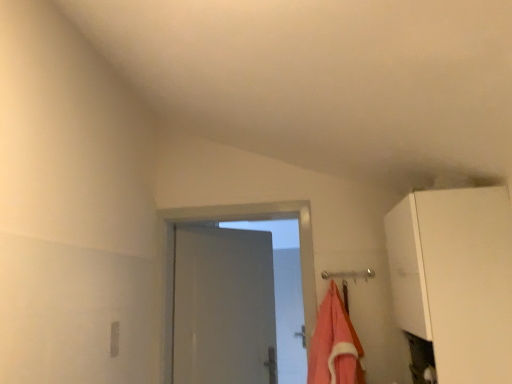
Describe the element at coordinates (334, 345) in the screenshot. I see `orange cotton towel at center` at that location.

Image resolution: width=512 pixels, height=384 pixels. Find the location of `orange cotton towel at center`. orange cotton towel at center is located at coordinates (334, 345).

Where is `white matte cabinet at upper right`? The width and height of the screenshot is (512, 384). white matte cabinet at upper right is located at coordinates (455, 279).

Image resolution: width=512 pixels, height=384 pixels. What do you see at coordinates (455, 279) in the screenshot?
I see `white matte cabinet at upper right` at bounding box center [455, 279].

In order to click on orange cotton towel at center in this screenshot , I will do `click(334, 345)`.

Is white matte cabinet at upper right at the left side of orange cotton towel at center?

No, white matte cabinet at upper right is not to the left of orange cotton towel at center.

Does white matte cabinet at upper right lie behind orange cotton towel at center?

That is False.

Which point is more forward, [417,333] or [324,303]?

The point [417,333] is closer.

From the image's perspective, is white matte cabinet at upper right below orange cotton towel at center?

No.

From a real-world perspective, is white matte cabinet at upper right physically above orange cotton towel at center?

Indeed, from a real-world perspective, white matte cabinet at upper right stands above orange cotton towel at center.

Is white matte cabinet at upper right wider or thinner than orange cotton towel at center?

Clearly, white matte cabinet at upper right has more width compared to orange cotton towel at center.

From their relative heights in the image, would you say white matte cabinet at upper right is taller or shorter than orange cotton towel at center?

white matte cabinet at upper right is taller than orange cotton towel at center.

Considering the sizes of white matte cabinet at upper right and orange cotton towel at center in the image, is white matte cabinet at upper right bigger or smaller than orange cotton towel at center?

Considering their sizes, white matte cabinet at upper right takes up more space than orange cotton towel at center.

Is white matte cabinet at upper right inside or outside of orange cotton towel at center?

white matte cabinet at upper right is not inside orange cotton towel at center, it's outside.

Are white matte cabinet at upper right and orange cotton towel at center far apart?

No, white matte cabinet at upper right is in close proximity to orange cotton towel at center.

Is white matte cabinet at upper right oriented away from orange cotton towel at center?

No.

Can you tell me how much white matte cabinet at upper right and orange cotton towel at center differ in facing direction?

87.1 degrees.

In order to click on cabinetry on the right of orange cotton towel at center in this screenshot , I will do `click(455, 279)`.

Can you confirm if orange cotton towel at center is positioned to the right of white matte cabinet at upper right?

Incorrect, orange cotton towel at center is not on the right side of white matte cabinet at upper right.

Considering their positions, is orange cotton towel at center located in front of or behind white matte cabinet at upper right?

Visually, orange cotton towel at center is located behind white matte cabinet at upper right.

Is point (339, 380) more distant than point (492, 292)?

Yes, it is behind point (492, 292).

From the image's perspective, is orange cotton towel at center positioned above or below white matte cabinet at upper right?

Based on their image positions, orange cotton towel at center is located beneath white matte cabinet at upper right.

From a real-world perspective, is orange cotton towel at center below white matte cabinet at upper right?

Correct, in the physical world, orange cotton towel at center is lower than white matte cabinet at upper right.

Which object is wider, orange cotton towel at center or white matte cabinet at upper right?

white matte cabinet at upper right.

Can you confirm if orange cotton towel at center is shorter than white matte cabinet at upper right?

Correct, orange cotton towel at center is not as tall as white matte cabinet at upper right.

From the picture: Who is smaller, orange cotton towel at center or white matte cabinet at upper right?

orange cotton towel at center is smaller.

Is orange cotton towel at center positioned beyond the bounds of white matte cabinet at upper right?

Yes, orange cotton towel at center is not within white matte cabinet at upper right.

Is there a large distance between orange cotton towel at center and white matte cabinet at upper right?

That's not correct — orange cotton towel at center is a little close to white matte cabinet at upper right.

Is orange cotton towel at center turned away from white matte cabinet at upper right?

That's not correct — orange cotton towel at center is not looking away from white matte cabinet at upper right.

Where is `beach towel below the white matte cabinet at upper right (from the image's perspective)`? beach towel below the white matte cabinet at upper right (from the image's perspective) is located at coordinates (334, 345).

Where is `cabinetry that appears in front of the orange cotton towel at center`? Image resolution: width=512 pixels, height=384 pixels. cabinetry that appears in front of the orange cotton towel at center is located at coordinates (455, 279).

At what (x,y) coordinates should I click in order to perform the action: click on beach towel below the white matte cabinet at upper right (from the image's perspective). Please return your answer as a coordinate pair (x, y). Looking at the image, I should click on (334, 345).